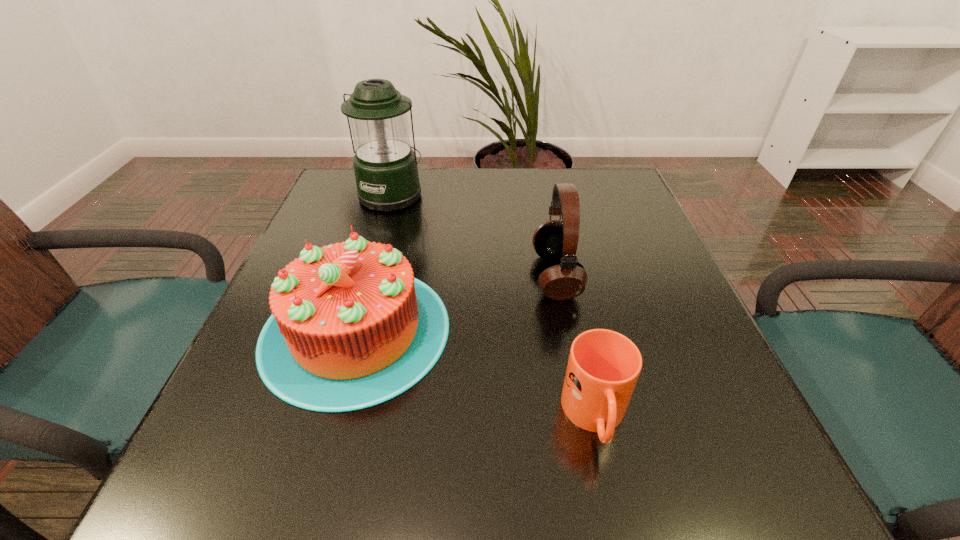
Locate an element on the screen. free spot that satisfies the following two spatial constraints: 1. on the ear pads of the headset; 2. on the front side of the cake is located at coordinates (566, 330).